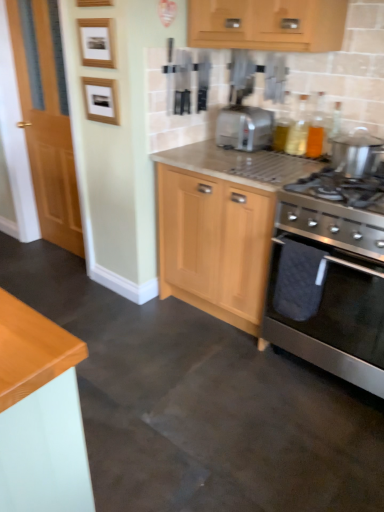
This screenshot has height=512, width=384. What are the coordinates of `blank space to the left of satin silver toaster at center` in the screenshot? It's located at (198, 151).